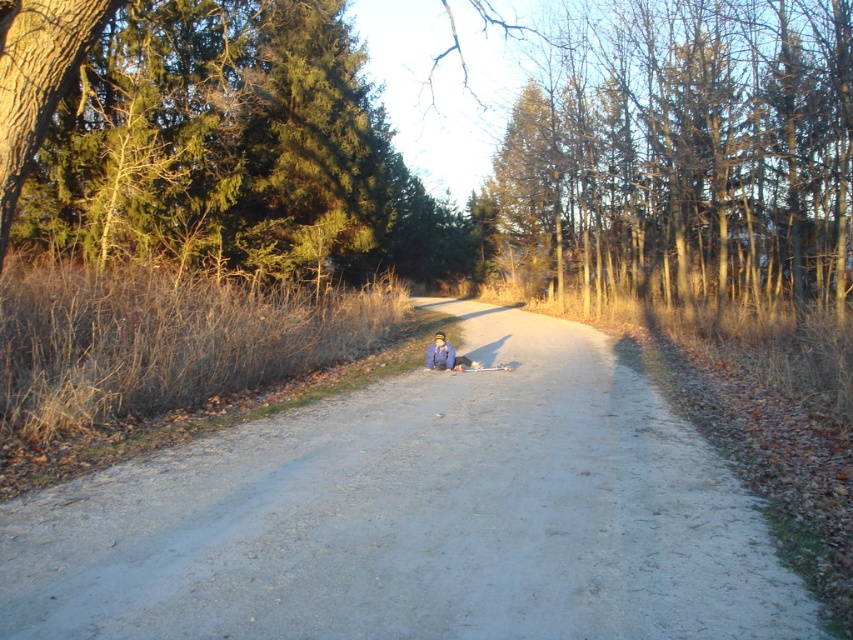
Does point (281, 465) come in front of point (434, 360)?

Yes, point (281, 465) is closer to viewer.

Can you confirm if gray gravel path at center is positioned above blue fabric jacket at center?

Incorrect, gray gravel path at center is not positioned above blue fabric jacket at center.

At what (x,y) coordinates should I click in order to perform the action: click on gray gravel path at center. Please return your answer as a coordinate pair (x, y). The height and width of the screenshot is (640, 853). Looking at the image, I should click on (416, 515).

This screenshot has height=640, width=853. I want to click on gray gravel path at center, so 416,515.